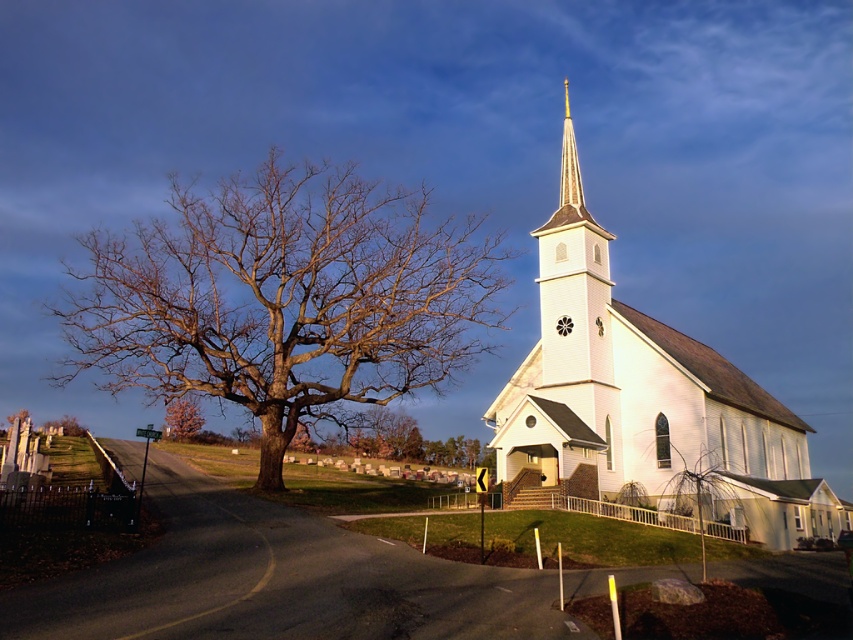
You are a photographer planning to capture the white wood church at center and the bare wood tree at left in a single frame. Given their heights, which object will appear larger in the photo?

The bare wood tree at left is much taller than the white wood church at center, so it will appear larger in the photo.

You are a photographer planning to capture the white wood church at center and the pink textured tree at lower left in a single frame. Based on their positions, which object should you focus on first to ensure both are in the shot?

The white wood church at center is positioned on the right side of the pink textured tree at lower left. To capture both in a single frame, you should focus on the pink textured tree at lower left first since it is on the left side, allowing you to frame the scene from left to right and include both objects within the composition.

You are standing in the middle of the field looking at the white wood church at center and the pink textured tree at lower left. Which object is nearer to you?

The white wood church at center is closer to the viewer than the pink textured tree at lower left.